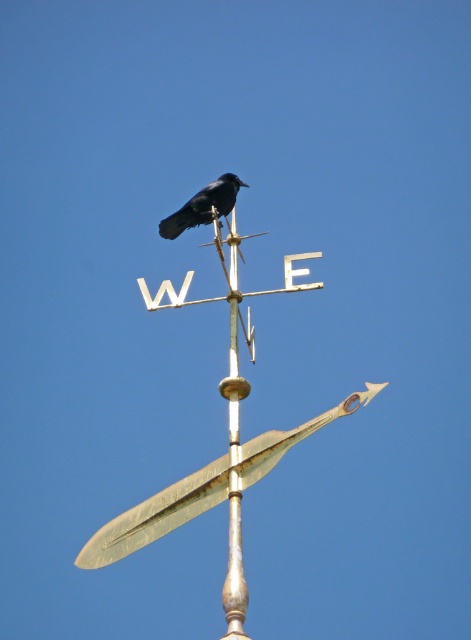
Which is in front, point (238, 579) or point (210, 216)?

Positioned in front is point (238, 579).

Who is more distant from viewer, (236, 460) or (219, 209)?

Positioned behind is point (219, 209).

Who is more forward, (228, 554) or (194, 204)?

Positioned in front is point (228, 554).

You are a GUI agent. You are given a task and a screenshot of the screen. Output one action in this format:
    pyautogui.click(x=<x>, y=<y>)
    Task: Click on the polished brass pole at center
    This screenshot has height=640, width=471.
    Given the screenshot: What is the action you would take?
    pyautogui.click(x=234, y=456)

Does gold polished metal spire at center appear on the right side of polished brass pole at center?

No, gold polished metal spire at center is not to the right of polished brass pole at center.

In the scene shown: Who is more forward, (103,563) or (236,269)?

Point (103,563) is in front.

Which is behind, point (235, 360) or point (228, 524)?

The point (228, 524) is more distant.

Locate an element on the screen. The height and width of the screenshot is (640, 471). gold polished metal spire at center is located at coordinates (219, 458).

Which is above, gold polished metal spire at center or black matte bird at center?

black matte bird at center

Is gold polished metal spire at center wider than black matte bird at center?

Correct, the width of gold polished metal spire at center exceeds that of black matte bird at center.

Locate an element on the screen. This screenshot has height=640, width=471. gold polished metal spire at center is located at coordinates (219, 458).